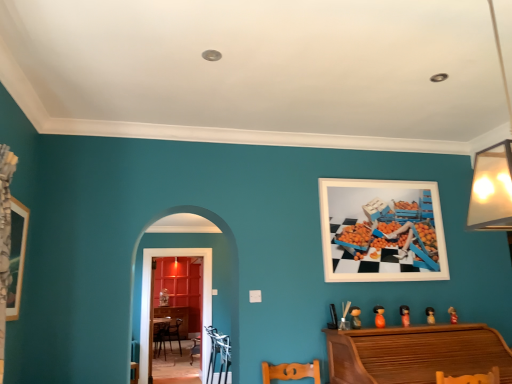
Identify the location of vacant space behind matte orange figurine at lower right, the 2th toy viewed from the right. This screenshot has width=512, height=384. (423, 324).